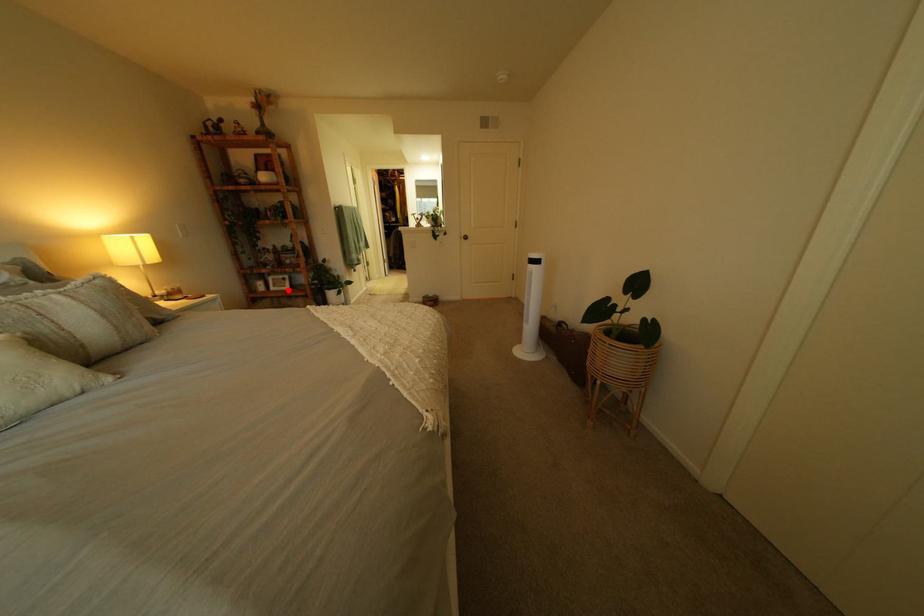
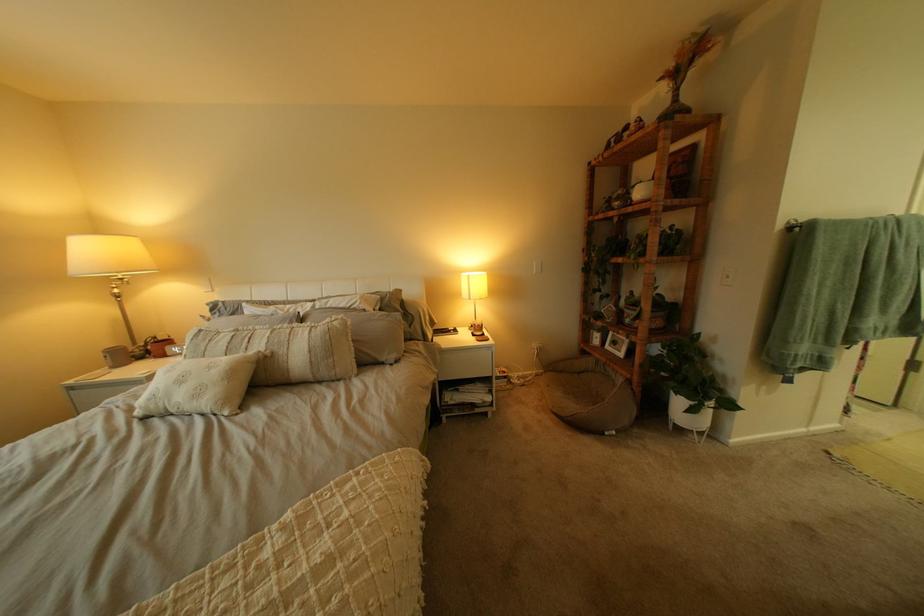
The point at the highlighted location is marked in the first image. Where is the corresponding point in the second image?

(623, 347)